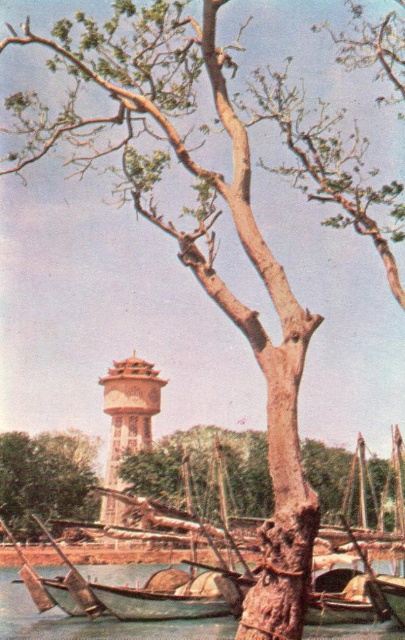
Question: Is wooden boat at lower center smaller than green rough bark tree at lower left?

Choices:
 (A) no
 (B) yes

Answer: (A)

Question: Is wooden boat at lower center closer to camera compared to green rough bark tree at lower left?

Choices:
 (A) yes
 (B) no

Answer: (A)

Question: Can you confirm if green rough bark tree at lower left is positioned to the left of wooden canoe at lower left?

Choices:
 (A) yes
 (B) no

Answer: (A)

Question: Which object is farther from the camera taking this photo?

Choices:
 (A) wooden canoe at lower left
 (B) wooden boat at lower center
 (C) brown textured water tower at center

Answer: (C)

Question: Which object appears farthest from the camera in this image?

Choices:
 (A) wooden canoe at lower left
 (B) brown textured water tower at center
 (C) wooden boat at lower center
 (D) brown rough tree trunk at center

Answer: (B)

Question: Based on their relative distances, which object is nearer to the wooden canoe at lower left?

Choices:
 (A) brown rough tree trunk at center
 (B) brown textured water tower at center

Answer: (A)